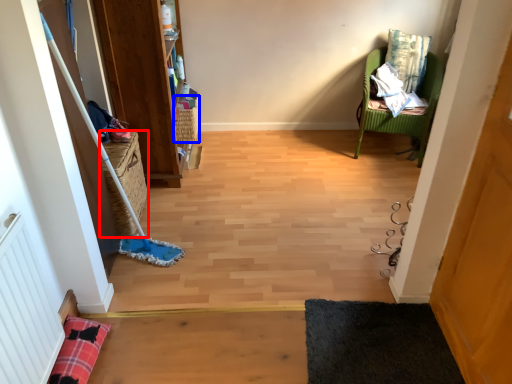
Question: Which of the following is the farthest to the observer, basket (highlighted by a red box) or basket (highlighted by a blue box)?

Choices:
 (A) basket
 (B) basket

Answer: (B)